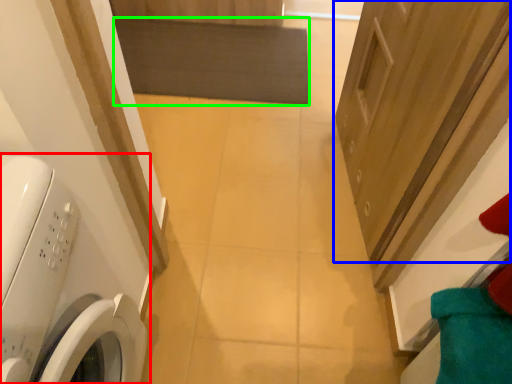
Question: Estimate the real-world distances between objects in this image. Which object is farther from washing machine (highlighted by a red box), door (highlighted by a blue box) or mat (highlighted by a green box)?

Choices:
 (A) door
 (B) mat

Answer: (B)